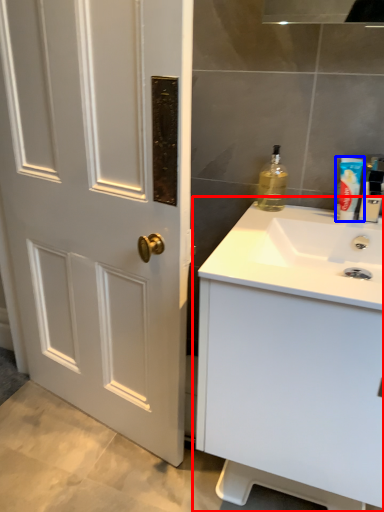
Question: Which object is closer to the camera taking this photo, bathroom cabinet (highlighted by a red box) or mouthwash (highlighted by a blue box)?

Choices:
 (A) bathroom cabinet
 (B) mouthwash

Answer: (A)